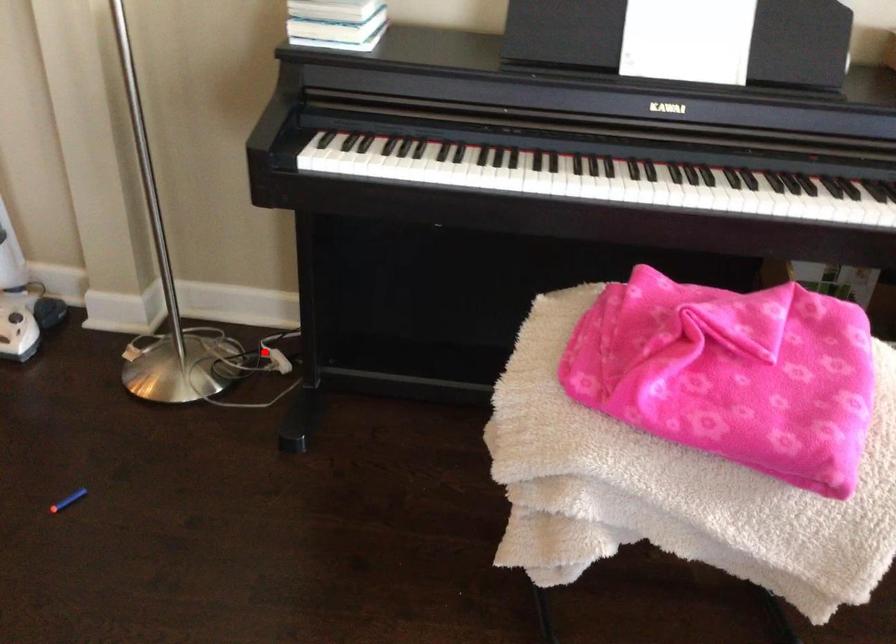
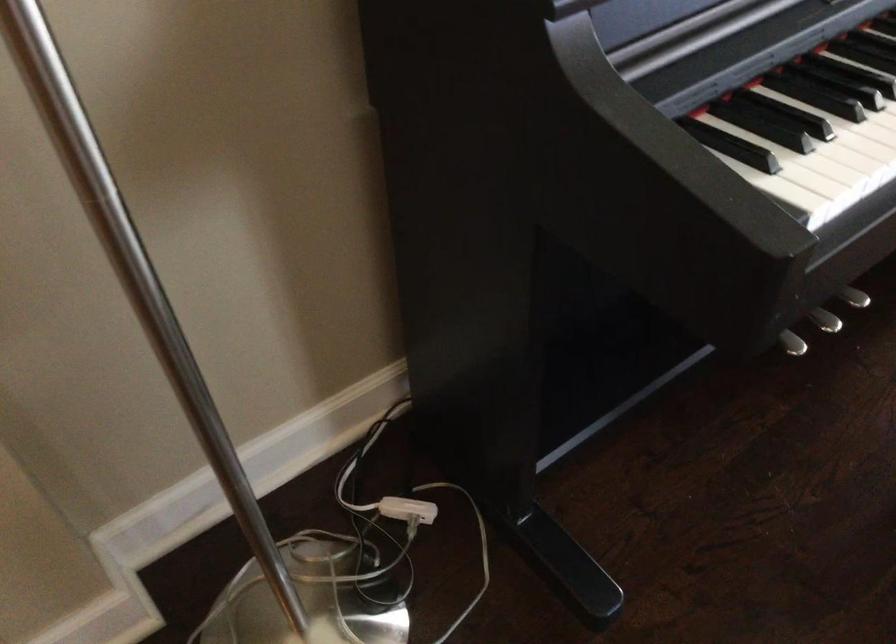
Locate, in the second image, the point that corresponds to the highlighted location in the first image.

(408, 509)